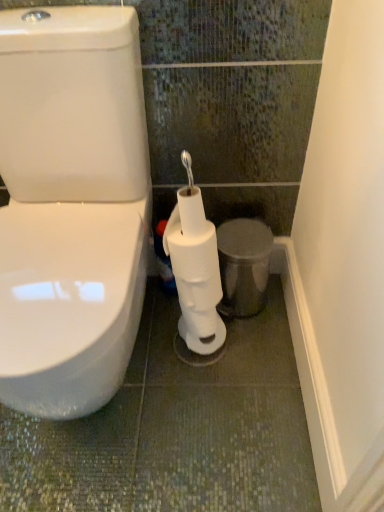
Question: Considering the relative sizes of white matte toilet paper at center, which is the 1th toilet paper from bottom to top, and metallic silver trash can at lower right in the image provided, is white matte toilet paper at center, which is the 1th toilet paper from bottom to top, wider than metallic silver trash can at lower right?

Choices:
 (A) yes
 (B) no

Answer: (A)

Question: From a real-world perspective, is white matte toilet paper at center, which is the 1th toilet paper from bottom to top, under metallic silver trash can at lower right?

Choices:
 (A) no
 (B) yes

Answer: (A)

Question: From the image's perspective, is white matte toilet paper at center, the 2th toilet paper when ordered from top to bottom, under metallic silver trash can at lower right?

Choices:
 (A) no
 (B) yes

Answer: (B)

Question: Is white matte toilet paper at center, which is the 1th toilet paper from bottom to top, to the left of metallic silver trash can at lower right from the viewer's perspective?

Choices:
 (A) yes
 (B) no

Answer: (A)

Question: Does white matte toilet paper at center, which is the 1th toilet paper from bottom to top, touch metallic silver trash can at lower right?

Choices:
 (A) no
 (B) yes

Answer: (A)

Question: From a real-world perspective, is metallic silver trash can at lower right physically located above or below white matte toilet paper at center, which is counted as the second toilet paper, starting from the bottom?

Choices:
 (A) above
 (B) below

Answer: (B)

Question: Is point (241, 294) closer or farther from the camera than point (208, 268)?

Choices:
 (A) closer
 (B) farther

Answer: (B)

Question: Considering the positions of metallic silver trash can at lower right and white matte toilet paper at center, which ranks as the first toilet paper in top-to-bottom order, in the image, is metallic silver trash can at lower right taller or shorter than white matte toilet paper at center, which ranks as the first toilet paper in top-to-bottom order,?

Choices:
 (A) tall
 (B) short

Answer: (A)

Question: From the image's perspective, is metallic silver trash can at lower right above or below white matte toilet paper at center, which is counted as the second toilet paper, starting from the bottom?

Choices:
 (A) below
 (B) above

Answer: (A)

Question: Is white matte toilet paper at center, the 2th toilet paper when ordered from top to bottom, bigger or smaller than white matte toilet paper at center, which ranks as the first toilet paper in top-to-bottom order?

Choices:
 (A) small
 (B) big

Answer: (B)

Question: Considering their positions, is white matte toilet paper at center, the 2th toilet paper when ordered from top to bottom, located in front of or behind white matte toilet paper at center, which is counted as the second toilet paper, starting from the bottom?

Choices:
 (A) behind
 (B) front

Answer: (B)

Question: Is white matte toilet paper at center, the 2th toilet paper when ordered from top to bottom, wider or thinner than white matte toilet paper at center, which ranks as the first toilet paper in top-to-bottom order?

Choices:
 (A) wide
 (B) thin

Answer: (A)

Question: From their relative heights in the image, would you say white matte toilet paper at center, the 2th toilet paper when ordered from top to bottom, is taller or shorter than white matte toilet paper at center, which ranks as the first toilet paper in top-to-bottom order?

Choices:
 (A) short
 (B) tall

Answer: (B)

Question: Is white matte toilet paper at center, which is the 1th toilet paper from bottom to top, wider or thinner than metallic silver trash can at lower right?

Choices:
 (A) thin
 (B) wide

Answer: (B)

Question: Considering their positions, is white matte toilet paper at center, the 2th toilet paper when ordered from top to bottom, located in front of or behind metallic silver trash can at lower right?

Choices:
 (A) behind
 (B) front

Answer: (B)